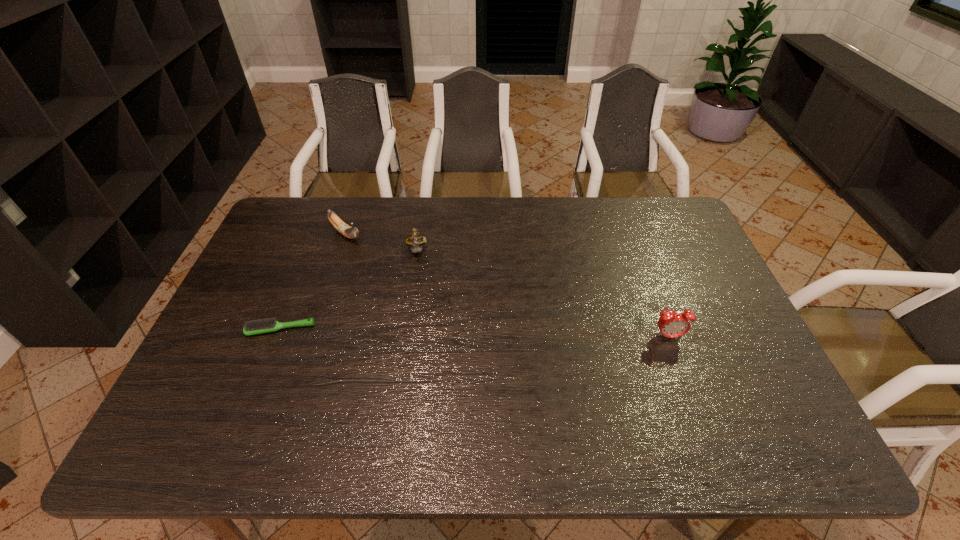
Find the location of a particular element. free spot between the alarm clock and the banana is located at coordinates (507, 285).

The height and width of the screenshot is (540, 960). Find the location of `free space between the alarm clock and the second object from right to left`. free space between the alarm clock and the second object from right to left is located at coordinates (542, 294).

In order to click on object that is the closest one to the second object from right to left in this screenshot , I will do `click(350, 232)`.

Image resolution: width=960 pixels, height=540 pixels. Identify the location of object that is the closest to the alarm clock. pos(415,239).

I want to click on blank area in the image that satisfies the following two spatial constraints: 1. on the back side of the banana; 2. on the right side of the hairbrush, so click(319, 234).